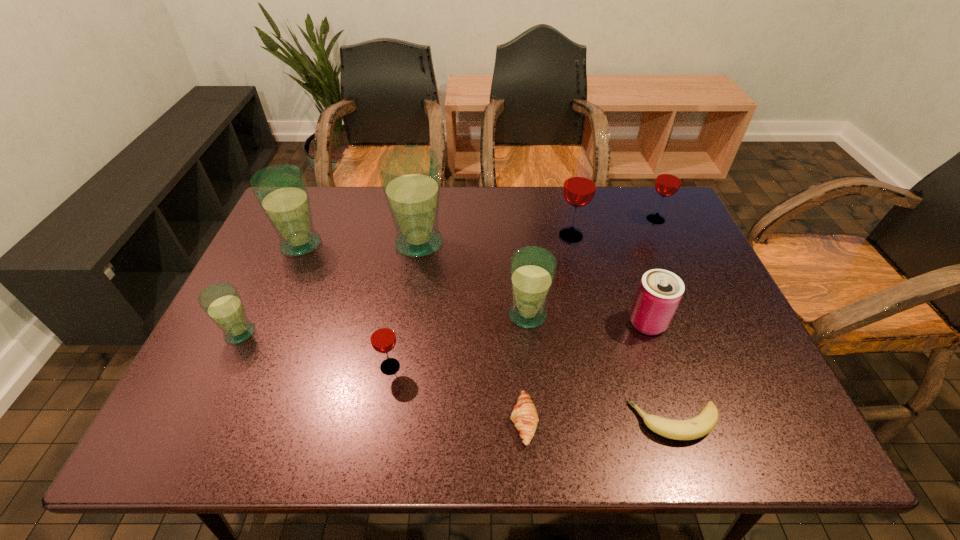
At what (x,y) coordinates should I click in order to perform the action: click on object identified as the third closest to the can. Please return your answer as a coordinate pair (x, y). This screenshot has height=540, width=960. Looking at the image, I should click on (579, 188).

Locate which object is the ninth closest to the tallest glass. Please provide its 2D coordinates. Your answer should be formatted as a tuple, i.e. [(x, y)], where the tuple contains the x and y coordinates of a point satisfying the conditions above.

[(668, 181)]

Find the location of `glass that can be found as the closest to the second glass from right to left`. glass that can be found as the closest to the second glass from right to left is located at coordinates (668, 181).

Locate which glass is the second closest to the pastry. Please provide its 2D coordinates. Your answer should be formatted as a tuple, i.e. [(x, y)], where the tuple contains the x and y coordinates of a point satisfying the conditions above.

[(383, 339)]

You are a GUI agent. You are given a task and a screenshot of the screen. Output one action in this format:
    pyautogui.click(x=<x>, y=<y>)
    Task: Click on the blue glass that can be found as the second closest to the third glass from right to left
    
    Given the screenshot: What is the action you would take?
    pyautogui.click(x=281, y=190)

Identify which blue glass is the fourth closest to the pastry. Please provide its 2D coordinates. Your answer should be formatted as a tuple, i.e. [(x, y)], where the tuple contains the x and y coordinates of a point satisfying the conditions above.

[(281, 190)]

Select which red glass is the closest to the smallest blue glass. Please provide its 2D coordinates. Your answer should be formatted as a tuple, i.e. [(x, y)], where the tuple contains the x and y coordinates of a point satisfying the conditions above.

[(383, 339)]

Identify which red glass is the nearest to the banana. Please provide its 2D coordinates. Your answer should be formatted as a tuple, i.e. [(x, y)], where the tuple contains the x and y coordinates of a point satisfying the conditions above.

[(383, 339)]

This screenshot has height=540, width=960. Find the location of `free region that satisfies the following two spatial constraints: 1. on the front side of the fifth glass from left to right; 2. on the front-facing side of the pastry`. free region that satisfies the following two spatial constraints: 1. on the front side of the fifth glass from left to right; 2. on the front-facing side of the pastry is located at coordinates (539, 421).

This screenshot has width=960, height=540. Identify the location of free spot that satisfies the following two spatial constraints: 1. on the back side of the smallest blue glass; 2. on the left side of the rightmost blue glass. (249, 315).